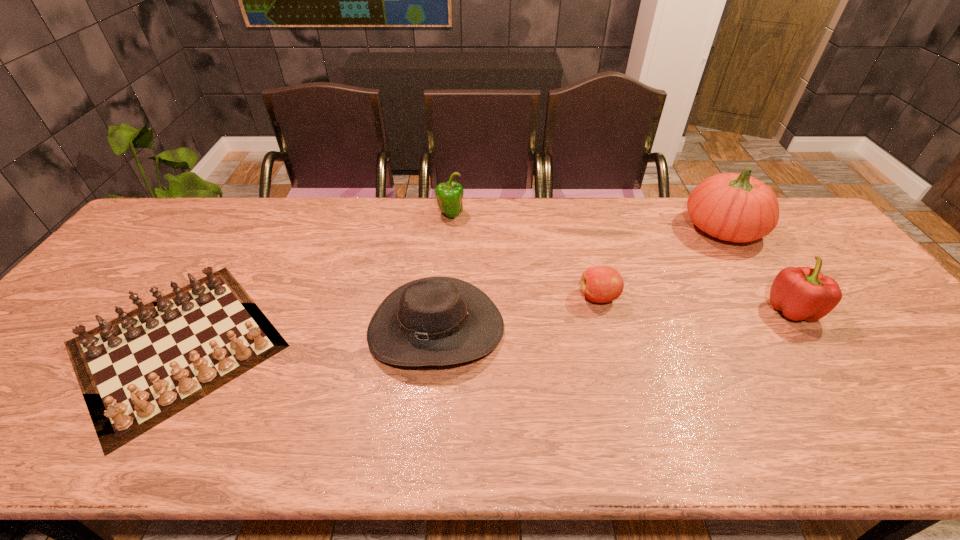
Where is `pumpkin`? pumpkin is located at coordinates (734, 207).

I want to click on the farther bell pepper, so click(x=449, y=195).

I want to click on the nearer bell pepper, so click(802, 293).

This screenshot has height=540, width=960. I want to click on cowboy hat, so click(435, 321).

Find the location of a particular element. This screenshot has height=540, width=960. apple is located at coordinates pyautogui.click(x=601, y=284).

Locate an element on the screen. The width and height of the screenshot is (960, 540). vacant region located on the front of the pumpkin is located at coordinates (787, 330).

The height and width of the screenshot is (540, 960). Identify the location of free region located 0.140m on the right of the left bell pepper. (506, 214).

Find the location of a particular element. This screenshot has width=960, height=540. free spot located 0.240m on the front of the nearer bell pepper is located at coordinates (865, 416).

In order to click on free space located on the front-facing side of the cowboy hat in this screenshot , I will do `click(427, 426)`.

Find the location of a particular element. The width and height of the screenshot is (960, 540). vacant space located 0.290m on the left of the apple is located at coordinates (473, 297).